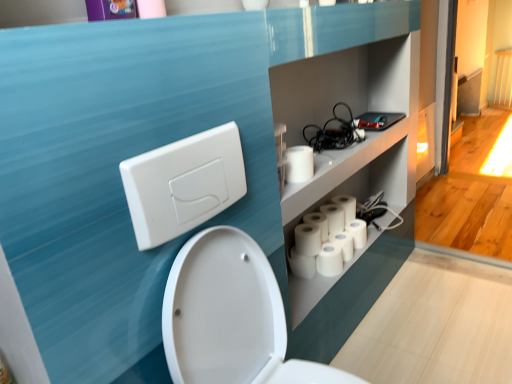
Question: Looking at the image, does white matte toilet paper at upper right, the sixth toilet paper positioned from the back, seem bigger or smaller compared to white matte toilet paper at lower center, which appears as the 2th toilet paper when viewed from the front?

Choices:
 (A) small
 (B) big

Answer: (A)

Question: In terms of height, does white matte toilet paper at upper right, marked as the first toilet paper in a front-to-back arrangement, look taller or shorter compared to white matte toilet paper at lower center, the 5th toilet paper viewed from the back?

Choices:
 (A) short
 (B) tall

Answer: (A)

Question: Estimate the real-world distances between objects in this image. Which object is closer to the white matte toilet paper at upper right, marked as the first toilet paper in a front-to-back arrangement?

Choices:
 (A) white plastic/light switch at upper left
 (B) white matte toilet paper at lower center, the 5th toilet paper positioned from the front
 (C) white glossy toilet at center
 (D) white matte toilet paper at lower center, which is counted as the 3th toilet paper, starting from the front
 (E) black rubber cables at upper right

Answer: (E)

Question: Which object is the farthest from the purple glossy picture frame at upper left?

Choices:
 (A) white matte toilet paper at lower center, which appears as the 2th toilet paper when viewed from the front
 (B) white matte toilet paper at lower center, the 5th toilet paper positioned from the front
 (C) black rubber cables at upper right
 (D) white matte toilet paper at lower center, positioned as the 1th toilet paper in back-to-front order
 (E) white glossy toilet at center

Answer: (D)